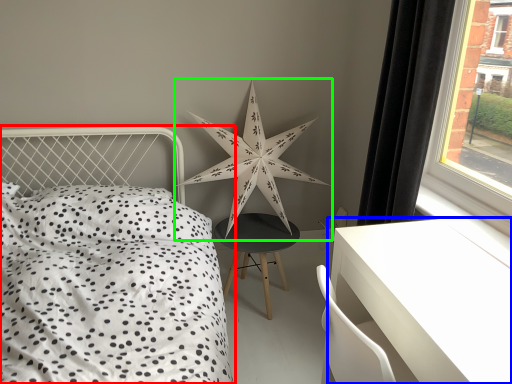
Question: Which object is the closest to the bed (highlighted by a red box)? Choose among these: table (highlighted by a blue box) or star (highlighted by a green box).

Choices:
 (A) table
 (B) star

Answer: (B)